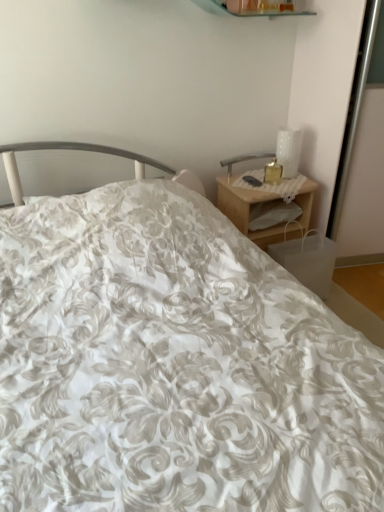
Question: Does white glossy table lamp at upper right have a lesser height compared to translucent glass candle at upper right?

Choices:
 (A) yes
 (B) no

Answer: (B)

Question: Is white glossy table lamp at upper right positioned in front of translucent glass candle at upper right?

Choices:
 (A) no
 (B) yes

Answer: (A)

Question: Can you confirm if white glossy table lamp at upper right is taller than translucent glass candle at upper right?

Choices:
 (A) yes
 (B) no

Answer: (A)

Question: Can you confirm if white glossy table lamp at upper right is thinner than translucent glass candle at upper right?

Choices:
 (A) no
 (B) yes

Answer: (A)

Question: Is white glossy table lamp at upper right far away from translucent glass candle at upper right?

Choices:
 (A) no
 (B) yes

Answer: (A)

Question: Is woodennightstand at right inside the boundaries of white glossy table lamp at upper right, or outside?

Choices:
 (A) outside
 (B) inside

Answer: (A)

Question: Considering their positions, is woodennightstand at right located in front of or behind white glossy table lamp at upper right?

Choices:
 (A) front
 (B) behind

Answer: (A)

Question: From the image's perspective, is woodennightstand at right positioned above or below white glossy table lamp at upper right?

Choices:
 (A) below
 (B) above

Answer: (A)

Question: Considering the positions of woodennightstand at right and white glossy table lamp at upper right in the image, is woodennightstand at right wider or thinner than white glossy table lamp at upper right?

Choices:
 (A) wide
 (B) thin

Answer: (A)

Question: Is white glossy table lamp at upper right taller or shorter than woodennightstand at right?

Choices:
 (A) short
 (B) tall

Answer: (A)

Question: Is white glossy table lamp at upper right in front of or behind woodennightstand at right in the image?

Choices:
 (A) front
 (B) behind

Answer: (B)

Question: Is white glossy table lamp at upper right situated inside woodennightstand at right or outside?

Choices:
 (A) inside
 (B) outside

Answer: (B)

Question: From the image's perspective, relative to woodennightstand at right, is white glossy table lamp at upper right above or below?

Choices:
 (A) below
 (B) above

Answer: (B)

Question: From a real-world perspective, is woodennightstand at right positioned above or below translucent glass candle at upper right?

Choices:
 (A) above
 (B) below

Answer: (B)

Question: Considering the positions of woodennightstand at right and translucent glass candle at upper right in the image, is woodennightstand at right wider or thinner than translucent glass candle at upper right?

Choices:
 (A) wide
 (B) thin

Answer: (A)